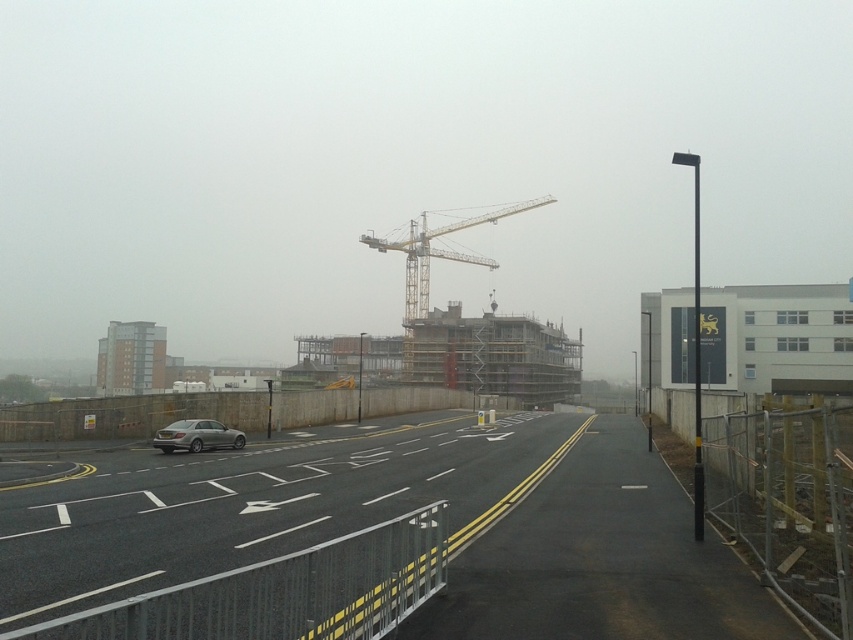
Question: Is yellow metallic crane at center to the right of satin silver sedan at center from the viewer's perspective?

Choices:
 (A) no
 (B) yes

Answer: (B)

Question: Does yellow metallic crane at center have a lesser width compared to satin silver sedan at center?

Choices:
 (A) no
 (B) yes

Answer: (A)

Question: Which object is positioned farthest from the satin silver sedan at center?

Choices:
 (A) dark asphalt highway at center
 (B) yellow metallic crane at center

Answer: (B)

Question: Considering the relative positions of dark asphalt highway at center and yellow metallic crane at center in the image provided, where is dark asphalt highway at center located with respect to yellow metallic crane at center?

Choices:
 (A) below
 (B) above

Answer: (A)

Question: Which object is the closest to the satin silver sedan at center?

Choices:
 (A) dark asphalt highway at center
 (B) yellow metallic crane at center

Answer: (A)

Question: Which object is positioned farthest from the satin silver sedan at center?

Choices:
 (A) dark asphalt highway at center
 (B) yellow metallic crane at center

Answer: (B)